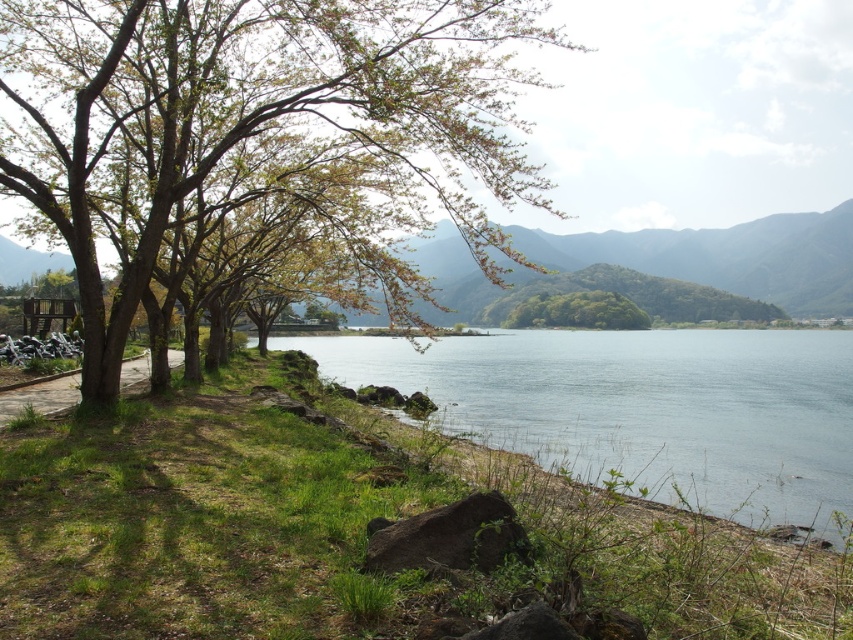
You are planning to take a photo of the smooth bark tree at left and the clear water at lower center from a position where both are visible. Which object will appear larger in the photo?

The smooth bark tree at left will appear larger in the photo because it is much taller than the clear water at lower center.

You are standing at the lakeside and want to take a photo of both the clear water at lower center and the green leafy hill at center. Which object should you focus on first if you want to capture both in the same frame without moving your camera?

You should focus on the clear water at lower center first because it is closer to you than the green leafy hill at center, allowing both to be in the same frame.